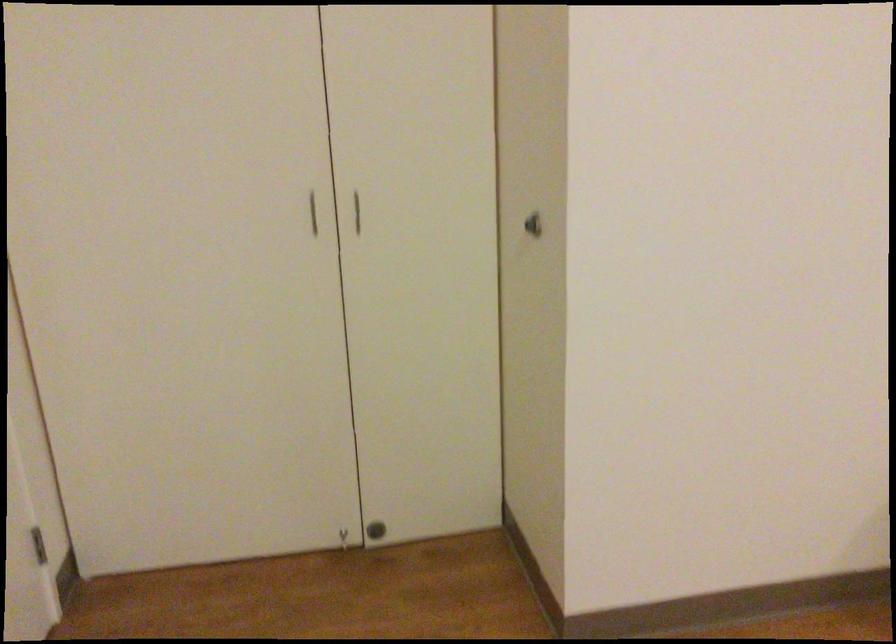
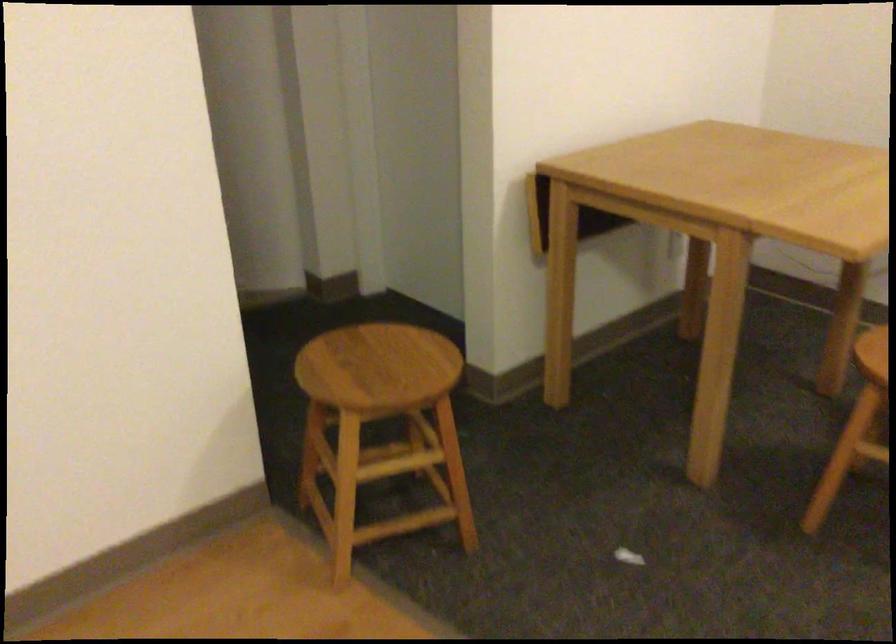
Question: The camera is either moving clockwise (left) or counter-clockwise (right) around the object. The first image is from the beginning of the video and the second image is from the end. Is the camera moving left or right when shooting the video?

Choices:
 (A) Left
 (B) Right

Answer: (A)